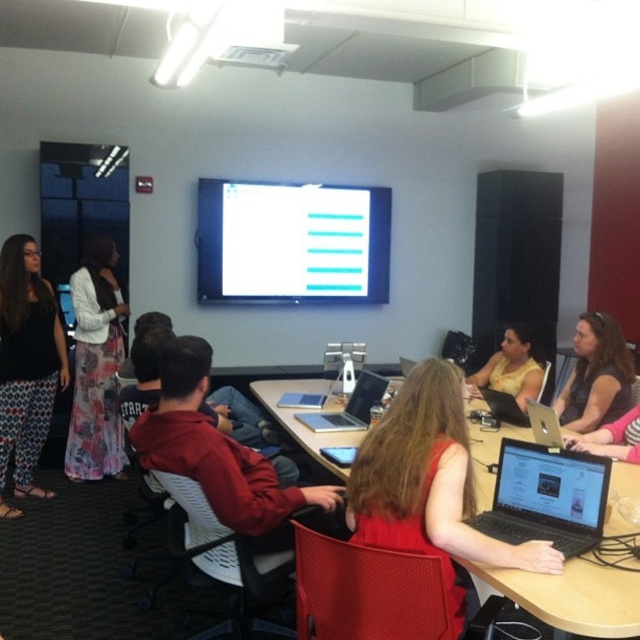
Question: Does black glossy laptop at center appear on the left side of white plastic projector at upper center?

Choices:
 (A) no
 (B) yes

Answer: (A)

Question: Which object is closer to the camera taking this photo?

Choices:
 (A) matte black tank top at left
 (B) red fabric jacket at center

Answer: (B)

Question: Is matte black tank top at left positioned before satin black laptop at center?

Choices:
 (A) yes
 (B) no

Answer: (B)

Question: Among these objects, which one is farthest from the camera?

Choices:
 (A) yellow matte dress at center
 (B) wooden table at center
 (C) black glossy laptop at center

Answer: (A)

Question: Where is white glossy projection screen at upper center located in relation to matte black tank top at left in the image?

Choices:
 (A) below
 (B) above

Answer: (B)

Question: Estimate the real-world distances between objects in this image. Which object is closer to the satin silver laptop at center?

Choices:
 (A) white glossy projection screen at upper center
 (B) black glossy laptop at center
 (C) matte black laptop at center
 (D) yellow matte dress at center

Answer: (C)